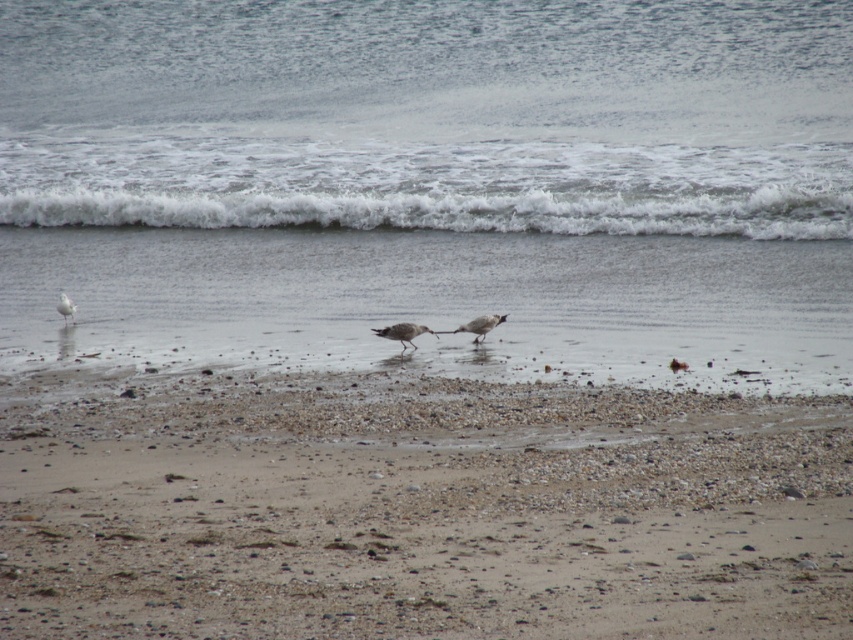
You are a photographer trying to capture the birds on the beach. You notice the white frothy water at center and the gray feathered bird at center. Which object in the scene is bigger?

The white frothy water at center is larger in size compared to the gray feathered bird at center.

You are standing on the beach and want to reach the point marked as point (140, 387). If you walk straight ahead, how far will you have to walk to reach that point?

The point (140, 387) is 12.37 meters from the camera, so you will have to walk 12.37 meters straight ahead to reach it.

You are a birdwatcher standing on the beach and want to observe both the white feathered bird at center and the gray feathered bird at center. How far apart are these two birds from each other?

The distance between the white feathered bird at center and the gray feathered bird at center is 16.00 inches.